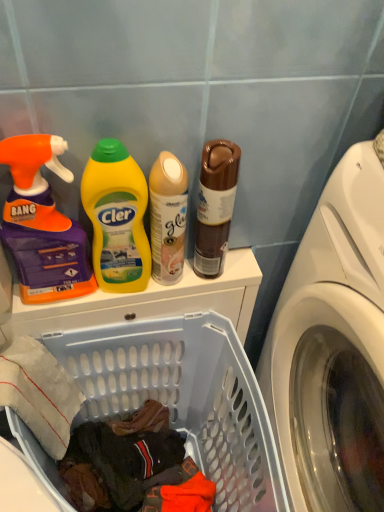
Question: Considering the relative positions of orange matte spray bottle at left, the 3th cleaning product viewed from the right, and translucent plastic laundry basket at lower left in the image provided, is orange matte spray bottle at left, the 3th cleaning product viewed from the right, to the left of translucent plastic laundry basket at lower left from the viewer's perspective?

Choices:
 (A) yes
 (B) no

Answer: (A)

Question: Does orange matte spray bottle at left, the first cleaning product in the left-to-right sequence, contain translucent plastic laundry basket at lower left?

Choices:
 (A) no
 (B) yes

Answer: (A)

Question: From the image's perspective, is orange matte spray bottle at left, the 3th cleaning product viewed from the right, on translucent plastic laundry basket at lower left?

Choices:
 (A) no
 (B) yes

Answer: (B)

Question: From the image's perspective, does orange matte spray bottle at left, the first cleaning product in the left-to-right sequence, appear lower than translucent plastic laundry basket at lower left?

Choices:
 (A) yes
 (B) no

Answer: (B)

Question: From a real-world perspective, is orange matte spray bottle at left, the 3th cleaning product viewed from the right, positioned under translucent plastic laundry basket at lower left based on gravity?

Choices:
 (A) yes
 (B) no

Answer: (B)

Question: From the image's perspective, is matte beige spray can at center, acting as the 1th cleaning product starting from the right, above or below translucent plastic laundry basket at lower left?

Choices:
 (A) below
 (B) above

Answer: (B)

Question: In terms of width, does matte beige spray can at center, placed as the 3th cleaning product when sorted from left to right, look wider or thinner when compared to translucent plastic laundry basket at lower left?

Choices:
 (A) wide
 (B) thin

Answer: (B)

Question: From a real-world perspective, is matte beige spray can at center, acting as the 1th cleaning product starting from the right, positioned above or below translucent plastic laundry basket at lower left?

Choices:
 (A) above
 (B) below

Answer: (A)

Question: Looking at the image, does matte beige spray can at center, acting as the 1th cleaning product starting from the right, seem bigger or smaller compared to translucent plastic laundry basket at lower left?

Choices:
 (A) small
 (B) big

Answer: (A)

Question: From a real-world perspective, relative to matte beige spray can at center, placed as the 3th cleaning product when sorted from left to right, is orange matte spray bottle at left, the first cleaning product in the left-to-right sequence, vertically above or below?

Choices:
 (A) below
 (B) above

Answer: (B)

Question: Looking at the image, does orange matte spray bottle at left, the first cleaning product in the left-to-right sequence, seem bigger or smaller compared to matte beige spray can at center, placed as the 3th cleaning product when sorted from left to right?

Choices:
 (A) big
 (B) small

Answer: (A)

Question: In terms of width, does orange matte spray bottle at left, the 3th cleaning product viewed from the right, look wider or thinner when compared to matte beige spray can at center, acting as the 1th cleaning product starting from the right?

Choices:
 (A) wide
 (B) thin

Answer: (A)

Question: In terms of height, does orange matte spray bottle at left, the first cleaning product in the left-to-right sequence, look taller or shorter compared to matte beige spray can at center, acting as the 1th cleaning product starting from the right?

Choices:
 (A) tall
 (B) short

Answer: (A)

Question: Considering the positions of point (49, 248) and point (115, 267), is point (49, 248) closer or farther from the camera than point (115, 267)?

Choices:
 (A) closer
 (B) farther

Answer: (A)

Question: Considering the positions of orange matte spray bottle at left, the 3th cleaning product viewed from the right, and yellow plastic bottle at center, acting as the 2th cleaning product starting from the right, in the image, is orange matte spray bottle at left, the 3th cleaning product viewed from the right, taller or shorter than yellow plastic bottle at center, acting as the 2th cleaning product starting from the right,?

Choices:
 (A) tall
 (B) short

Answer: (A)